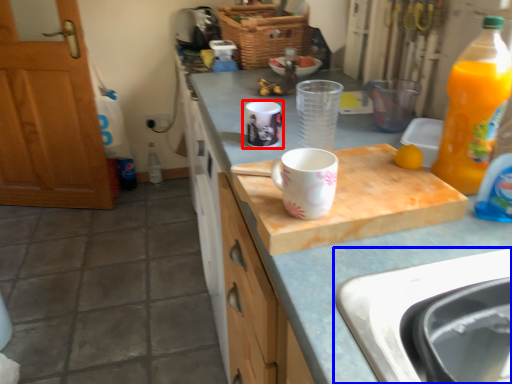
Question: Which object is closer to the camera taking this photo, coffee cup (highlighted by a red box) or sink (highlighted by a blue box)?

Choices:
 (A) coffee cup
 (B) sink

Answer: (B)